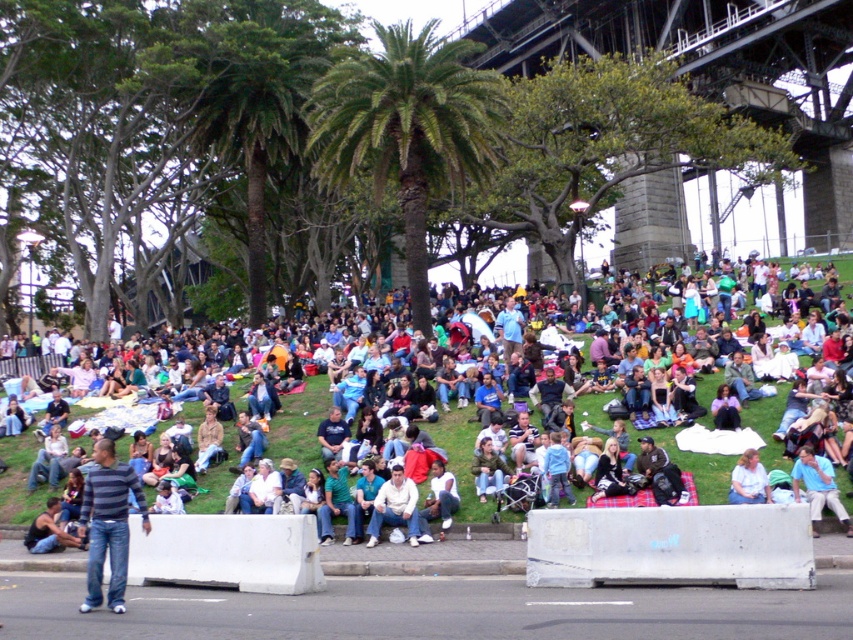
Locate an element on the screen. metallic steel bridge at upper center is located at coordinates (712, 68).

Consider the image. Is metallic steel bridge at upper center above striped shirt at lower left?

Correct, metallic steel bridge at upper center is located above striped shirt at lower left.

Where is `metallic steel bridge at upper center`? The width and height of the screenshot is (853, 640). metallic steel bridge at upper center is located at coordinates (712, 68).

Find the location of a particular element. metallic steel bridge at upper center is located at coordinates (712, 68).

Measure the distance from striped shirt at lower left to light blue shirt at center.

They are 43.43 feet apart.

Can you confirm if striped shirt at lower left is taller than light blue shirt at center?

Yes, striped shirt at lower left is taller than light blue shirt at center.

Locate an element on the screen. The height and width of the screenshot is (640, 853). striped shirt at lower left is located at coordinates coord(238,388).

Identify the location of striped shirt at lower left. (238, 388).

Between metallic steel bridge at upper center and green leafy palm tree at center, which one has more height?

Standing taller between the two is metallic steel bridge at upper center.

Consider the image. Which is above, metallic steel bridge at upper center or green leafy palm tree at center?

metallic steel bridge at upper center is higher up.

This screenshot has width=853, height=640. What do you see at coordinates (712, 68) in the screenshot?
I see `metallic steel bridge at upper center` at bounding box center [712, 68].

Image resolution: width=853 pixels, height=640 pixels. I want to click on metallic steel bridge at upper center, so click(712, 68).